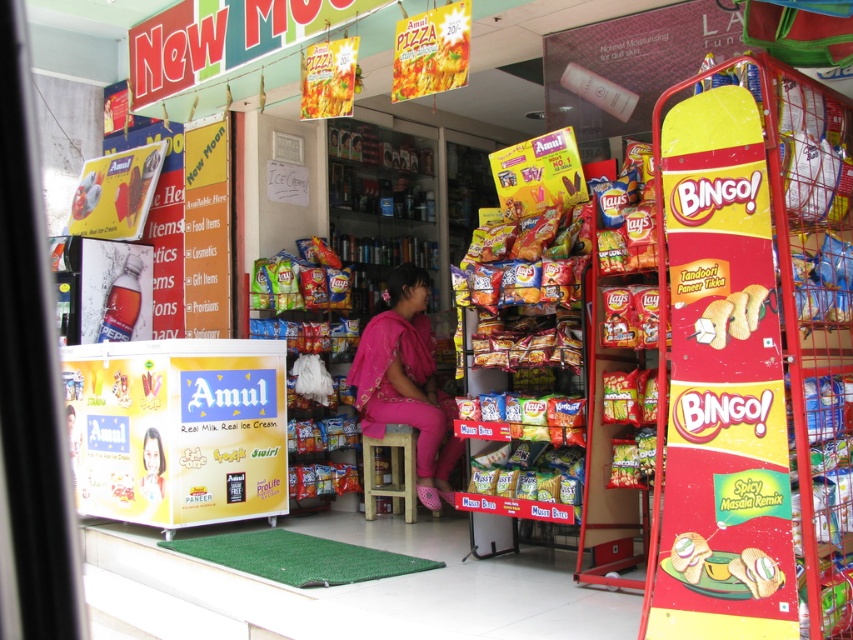
Does pink fabric dress at center appear on the right side of golden crispy bread at right?

In fact, pink fabric dress at center is to the left of golden crispy bread at right.

Describe the element at coordinates (405, 381) in the screenshot. This screenshot has width=853, height=640. I see `pink fabric dress at center` at that location.

The image size is (853, 640). What are the coordinates of `pink fabric dress at center` in the screenshot? It's located at (405, 381).

This screenshot has width=853, height=640. I want to click on pink fabric dress at center, so 405,381.

Looking at this image, can you confirm if wooden stool at center is positioned below golden crispy bread at right?

Correct, wooden stool at center is located below golden crispy bread at right.

Is wooden stool at center behind golden crispy bread at right?

That is True.

The image size is (853, 640). What do you see at coordinates (392, 472) in the screenshot?
I see `wooden stool at center` at bounding box center [392, 472].

Locate an element on the screen. The image size is (853, 640). wooden stool at center is located at coordinates (392, 472).

Looking at this image, between yellow matte snack at center and smooth pink dress at center, which one has more height?

smooth pink dress at center is taller.

Who is more forward, (670,561) or (148,484)?

Point (670,561) is more forward.

Does point (676, 560) lie behind point (149, 432)?

No, (676, 560) is closer to viewer.

The height and width of the screenshot is (640, 853). What are the coordinates of `yellow matte snack at center` in the screenshot? It's located at (689, 556).